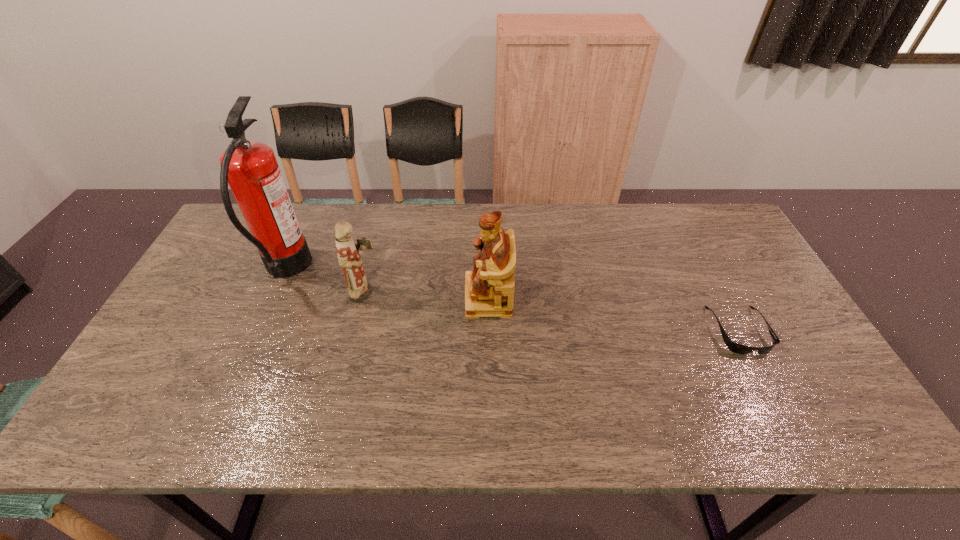
Where is `empty location between the second object from left to right and the fire extinguisher`? This screenshot has height=540, width=960. empty location between the second object from left to right and the fire extinguisher is located at coordinates (326, 281).

Where is `empty location between the second object from right to left and the left figurine`? Image resolution: width=960 pixels, height=540 pixels. empty location between the second object from right to left and the left figurine is located at coordinates (427, 295).

The height and width of the screenshot is (540, 960). Find the location of `empty space between the tallest object and the left figurine`. empty space between the tallest object and the left figurine is located at coordinates point(326,281).

Where is `free spot between the third object from right to left and the right figurine`? free spot between the third object from right to left and the right figurine is located at coordinates (427, 295).

Locate an element on the screen. The image size is (960, 540). free space between the shortest object and the right figurine is located at coordinates (613, 314).

This screenshot has width=960, height=540. In order to click on vacant space in between the leftmost object and the right figurine in this screenshot , I will do `click(387, 284)`.

Where is `vacant area that lies between the shortest object and the second object from right to left`? Image resolution: width=960 pixels, height=540 pixels. vacant area that lies between the shortest object and the second object from right to left is located at coordinates (613, 314).

I want to click on the third closest object to the leftmost object, so click(x=734, y=347).

Locate which object is the closest to the shortest object. Please provide its 2D coordinates. Your answer should be formatted as a tuple, i.e. [(x, y)], where the tuple contains the x and y coordinates of a point satisfying the conditions above.

[(489, 289)]